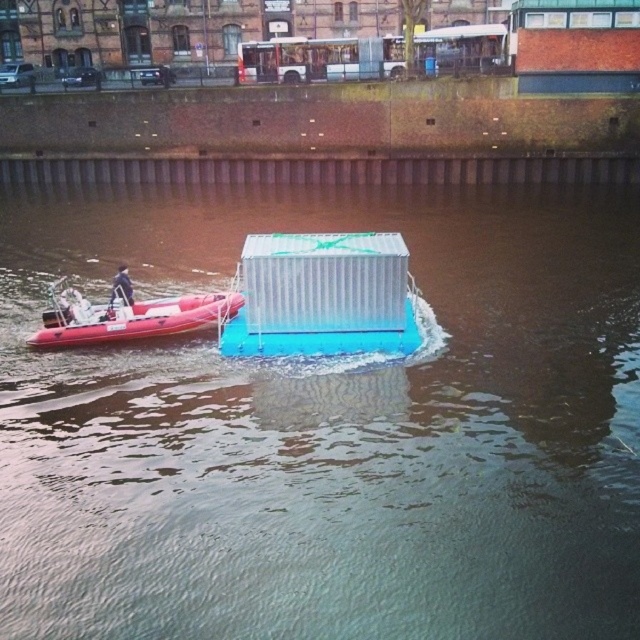
Question: Which of the following is the closest to the observer?

Choices:
 (A) rubber boat at left
 (B) metallic blue container at center

Answer: (B)

Question: Does metallic blue container at center lie in front of rubber boat at left?

Choices:
 (A) yes
 (B) no

Answer: (A)

Question: Is metallic blue container at center bigger than rubber boat at left?

Choices:
 (A) yes
 (B) no

Answer: (A)

Question: Which point appears closest to the camera in this image?

Choices:
 (A) (531, 316)
 (B) (218, 296)

Answer: (B)

Question: Does metallic blue container at center appear on the right side of rubber boat at left?

Choices:
 (A) no
 (B) yes

Answer: (B)

Question: Which point appears farthest from the camera in this image?

Choices:
 (A) (227, 308)
 (B) (160, 195)

Answer: (B)